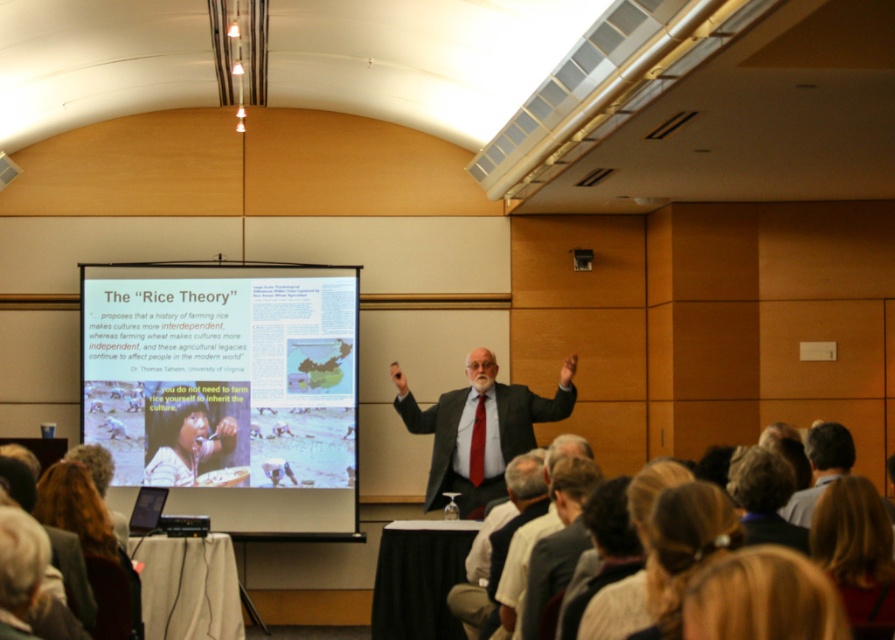
Does blonde hair at upper right have a lesser width compared to dark brown hair at upper center?

Yes, blonde hair at upper right is thinner than dark brown hair at upper center.

Which is more to the right, blonde hair at upper right or dark brown hair at upper center?

Positioned to the right is blonde hair at upper right.

Between point (892, 564) and point (777, 481), which one is positioned behind?

The point (777, 481) is behind.

Locate an element on the screen. The height and width of the screenshot is (640, 895). blonde hair at upper right is located at coordinates (857, 550).

Consider the image. Between blonde hair at lower right and dark brown hair at upper center, which one has more height?

blonde hair at lower right is taller.

Does blonde hair at lower right appear on the left side of dark brown hair at upper center?

Correct, you'll find blonde hair at lower right to the left of dark brown hair at upper center.

Based on the photo, who is more distant from viewer, (766, 428) or (766, 532)?

The point (766, 428) is more distant.

Where is `blonde hair at lower right`? The width and height of the screenshot is (895, 640). blonde hair at lower right is located at coordinates (476, 576).

Is white matte projection screen at center to the right of blonde hair at lower right from the viewer's perspective?

No, white matte projection screen at center is not to the right of blonde hair at lower right.

Is white matte projection screen at center in front of blonde hair at lower right?

No.

Between point (200, 284) and point (518, 540), which one is positioned behind?

Point (200, 284)

Image resolution: width=895 pixels, height=640 pixels. What are the coordinates of `white matte projection screen at center` in the screenshot? It's located at (226, 388).